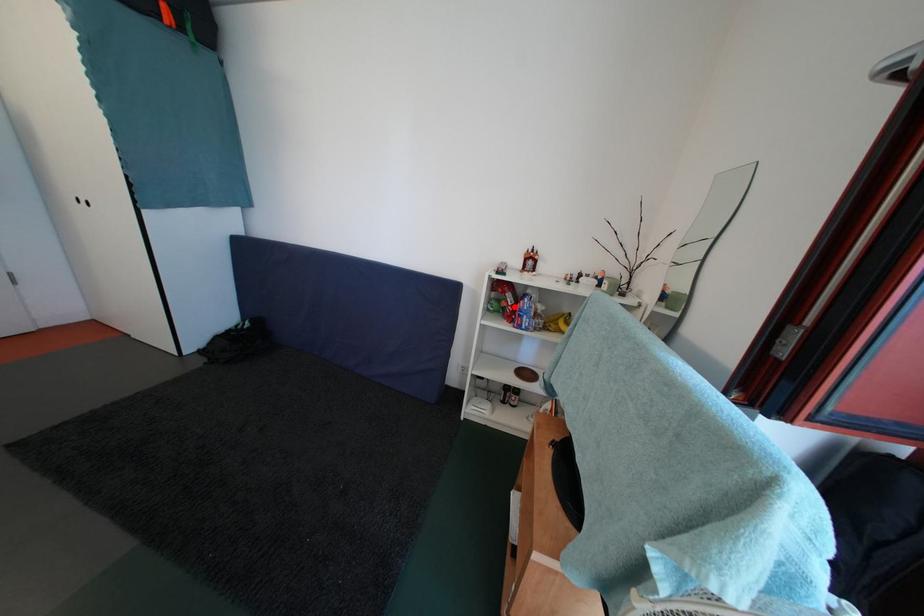
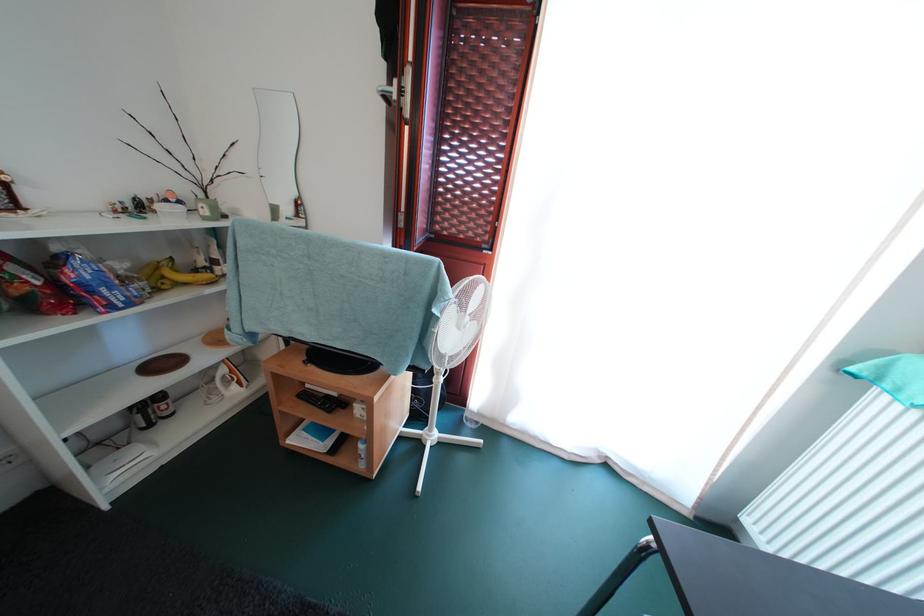
Question: I am providing you with two images of the same scene from different viewpoints. A red point is marked on the first image. At the location where the point appears in image 1, is it still visible in image 2?

Choices:
 (A) Yes
 (B) No

Answer: (A)